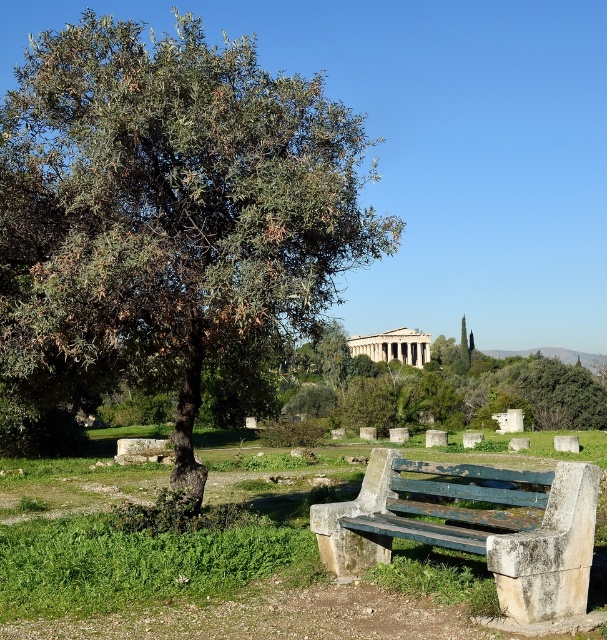
Which is above, green leafy olive tree at upper left or green leafy tree at center?

Positioned higher is green leafy olive tree at upper left.

Based on the photo, can you confirm if green leafy olive tree at upper left is wider than green leafy tree at center?

No.

Identify the location of green leafy olive tree at upper left. The height and width of the screenshot is (640, 607). (168, 211).

Which is more to the left, green leafy olive tree at upper left or green weathered wood bench at lower center?

From the viewer's perspective, green leafy olive tree at upper left appears more on the left side.

Which is more to the right, green leafy olive tree at upper left or green weathered wood bench at lower center?

Positioned to the right is green weathered wood bench at lower center.

Locate an element on the screen. The width and height of the screenshot is (607, 640). green leafy olive tree at upper left is located at coordinates (168, 211).

Is green weathered wood bench at lower center smaller than green leafy tree at center?

Yes.

Is point (574, 600) closer to camera compared to point (489, 416)?

Yes, point (574, 600) is closer to viewer.

At what (x,y) coordinates should I click in order to perform the action: click on green weathered wood bench at lower center. Please return your answer as a coordinate pair (x, y). The width and height of the screenshot is (607, 640). Looking at the image, I should click on (475, 528).